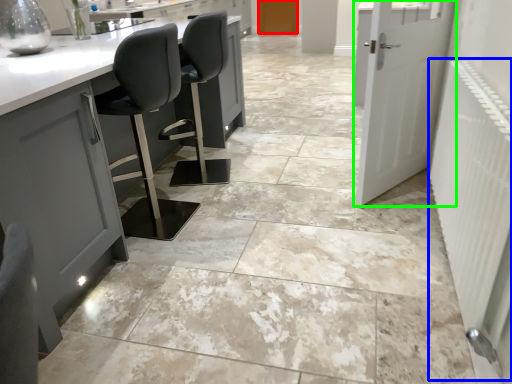
Question: Which object is the closest to the door (highlighted by a red box)? Choose among these: radiator (highlighted by a blue box) or door (highlighted by a green box).

Choices:
 (A) radiator
 (B) door

Answer: (B)